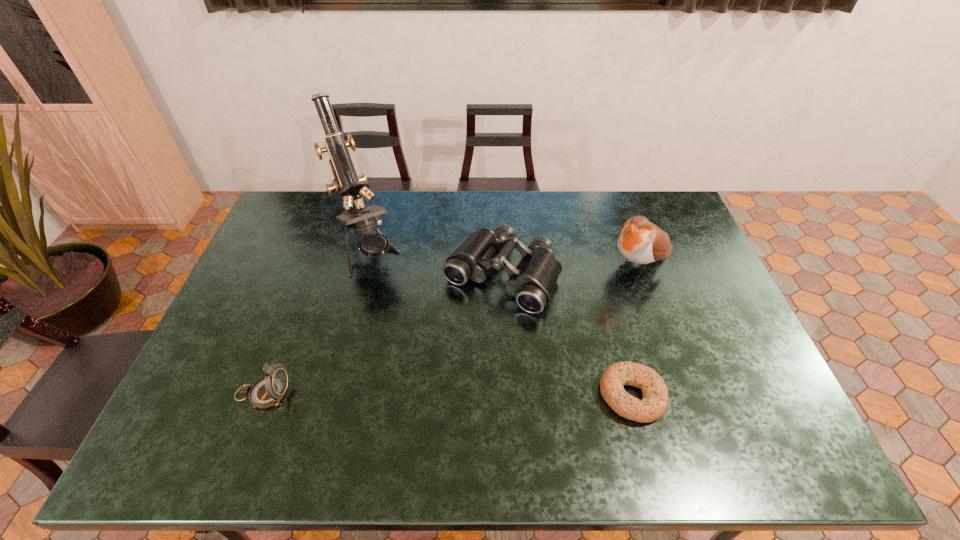
Find the location of `vacant region located through the eyepiece of the tallest object`. vacant region located through the eyepiece of the tallest object is located at coordinates (399, 320).

At what (x,y) coordinates should I click in order to perform the action: click on free space located through the eyepiece of the tallest object. Please return your answer as a coordinate pair (x, y). The image size is (960, 540). Looking at the image, I should click on (387, 297).

The width and height of the screenshot is (960, 540). In order to click on vacant region located 0.220m through the eyepiece of the tallest object in this screenshot , I will do `click(403, 327)`.

At what (x,y) coordinates should I click in order to perform the action: click on free space located on the front-facing side of the third object from right to left. Please return your answer as a coordinate pair (x, y). The image size is (960, 540). Looking at the image, I should click on [463, 330].

Where is `vacant space located 0.220m on the front-facing side of the third object from right to left`? The image size is (960, 540). vacant space located 0.220m on the front-facing side of the third object from right to left is located at coordinates (435, 372).

Identify the location of free region located 0.200m on the front-facing side of the third object from right to left. (440, 366).

You are a GUI agent. You are given a task and a screenshot of the screen. Output one action in this format:
    pyautogui.click(x=<x>, y=<y>)
    Task: Click on the object that is at the far edge
    This screenshot has width=960, height=540.
    Given the screenshot: What is the action you would take?
    pyautogui.click(x=349, y=185)

Find the location of a particular element. compass that is positioned at the near edge is located at coordinates (268, 391).

I want to click on bagel that is at the near edge, so click(653, 405).

Locate an element on the screen. This screenshot has height=540, width=960. object at the left edge is located at coordinates (268, 391).